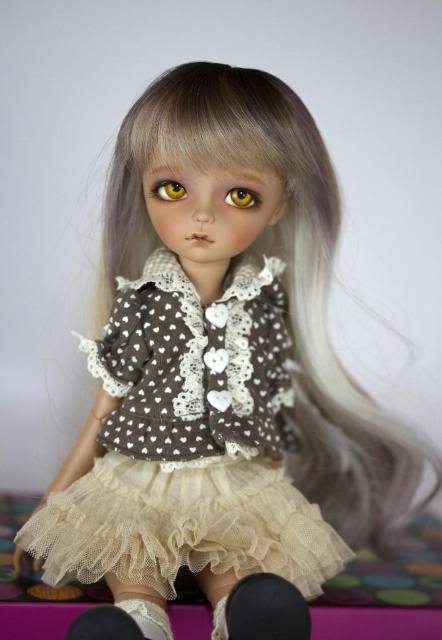
You are a fashion designer who wants to create a miniature version of the doll. Since the white lace dress at center and the brown glossy eye at center are important features, which one should you focus on scaling down more carefully to maintain the doll proportions?

The brown glossy eye at center should be scaled down more carefully because it is smaller than the white lace dress at center, so maintaining its size proportionally is crucial for the miniature version.